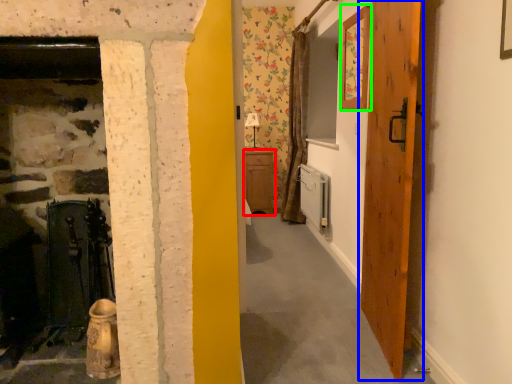
Question: Based on their relative distances, which object is farther from cabinetry (highlighted by a red box)? Choose from door (highlighted by a blue box) and picture frame (highlighted by a green box).

Choices:
 (A) door
 (B) picture frame

Answer: (A)